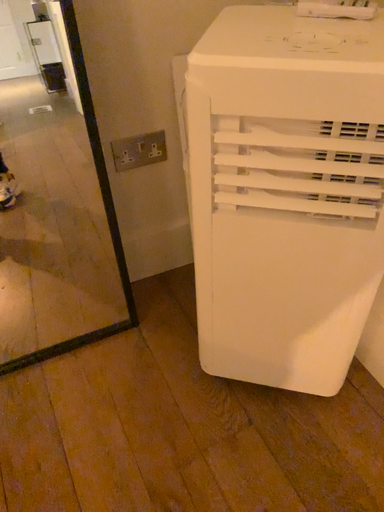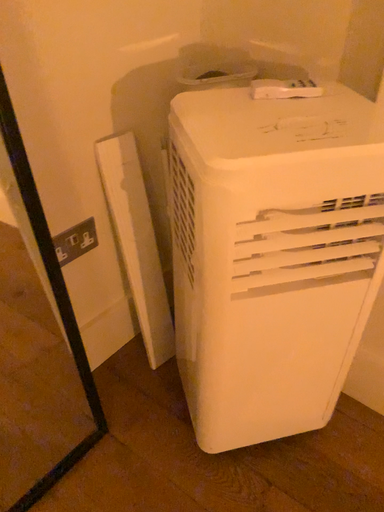
Question: How did the camera likely rotate when shooting the video?

Choices:
 (A) rotated upward
 (B) rotated downward

Answer: (A)